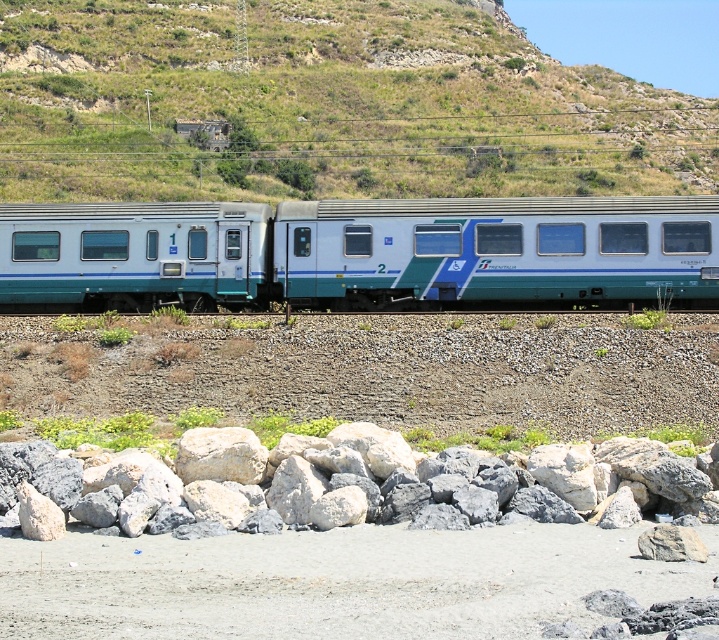
You are a maintenance worker needing to inspect the gap between the white glossy train car at center and the matte blue train car at left. Your inspection tool is 5 meters long. Can you fully extend it across the gap between the two cars?

The gap between the white glossy train car at center and the matte blue train car at left is 5.65 meters. Since your tool is only 5 meters long, it cannot fully span the gap.

You are standing on the train and looking out the window. You see two points marked on the ground outside. The first point is at coordinates point (111,35) and the second is at point (252,253). Which point is closer to you?

Point (111,35) is further to the camera than point (252,253), so the second point is closer to you.